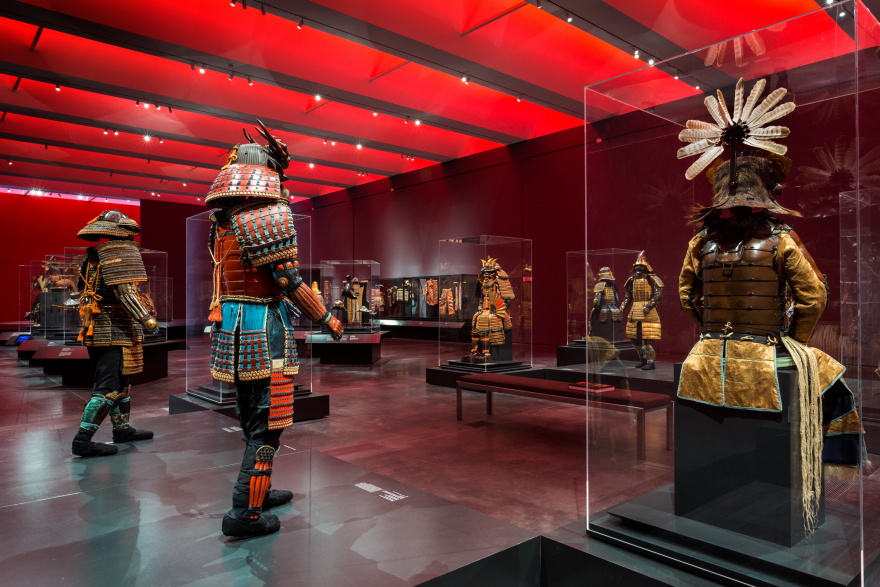
Locate an element on the screen. The width and height of the screenshot is (880, 587). place to sit is located at coordinates (550, 374).